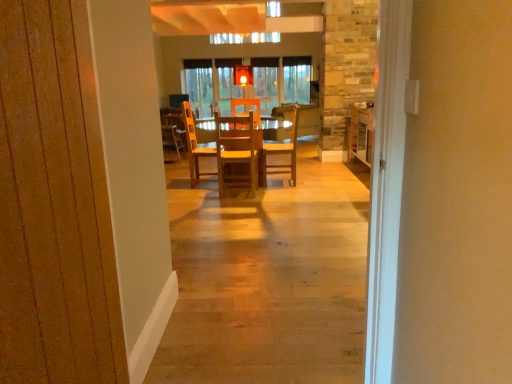
Question: Which direction should I rotate to look at wooden chair at center, which is counted as the third chair, starting from the front?

Choices:
 (A) left
 (B) right

Answer: (B)

Question: From the image's perspective, is wooden at center, placed as the second chair when sorted from front to back, on top of wooden chair at center, the 4th chair positioned from the left?

Choices:
 (A) yes
 (B) no

Answer: (B)

Question: Does wooden at center, the second chair when ordered from right to left, have a greater height compared to wooden chair at center, which is the 2th chair in back-to-front order?

Choices:
 (A) no
 (B) yes

Answer: (A)

Question: Does wooden at center, placed as the 3th chair when sorted from left to right, have a smaller size compared to wooden chair at center, the 4th chair positioned from the left?

Choices:
 (A) yes
 (B) no

Answer: (B)

Question: Is wooden at center, which is the third chair from back to front, outside of wooden chair at center, the 4th chair positioned from the left?

Choices:
 (A) no
 (B) yes

Answer: (B)

Question: Considering the relative sizes of wooden at center, which is the third chair from back to front, and wooden chair at center, the 4th chair positioned from the left, in the image provided, is wooden at center, which is the third chair from back to front, bigger than wooden chair at center, the 4th chair positioned from the left,?

Choices:
 (A) yes
 (B) no

Answer: (A)

Question: Is wooden chair at center, arranged as the 1th chair when viewed from the right, completely or partially inside wooden at center, which is the third chair from back to front?

Choices:
 (A) no
 (B) yes

Answer: (B)

Question: Is wooden chair at center, which is the third chair in right-to-left order, beside wooden chair at center, which is counted as the third chair, starting from the front?

Choices:
 (A) no
 (B) yes

Answer: (A)

Question: Is wooden chair at center, the first chair positioned from the front, not within wooden chair at center, which is the 2th chair in back-to-front order?

Choices:
 (A) yes
 (B) no

Answer: (A)

Question: Considering the relative sizes of wooden chair at center, which is the third chair in right-to-left order, and wooden chair at center, which is the 2th chair in back-to-front order, in the image provided, is wooden chair at center, which is the third chair in right-to-left order, shorter than wooden chair at center, which is the 2th chair in back-to-front order,?

Choices:
 (A) no
 (B) yes

Answer: (B)

Question: Is wooden chair at center, the first chair positioned from the front, wider than wooden chair at center, arranged as the 1th chair when viewed from the right?

Choices:
 (A) no
 (B) yes

Answer: (A)

Question: From the image's perspective, is wooden chair at center, the first chair positioned from the front, located above wooden chair at center, arranged as the 1th chair when viewed from the right?

Choices:
 (A) yes
 (B) no

Answer: (B)

Question: Can you confirm if wooden chair at center, the first chair positioned from the front, is positioned to the left of wooden chair at center, which is the 2th chair in back-to-front order?

Choices:
 (A) yes
 (B) no

Answer: (A)

Question: Does wooden chair at center, the 1th chair in the left-to-right sequence, have a smaller size compared to wooden at center, which is the third chair from back to front?

Choices:
 (A) no
 (B) yes

Answer: (B)